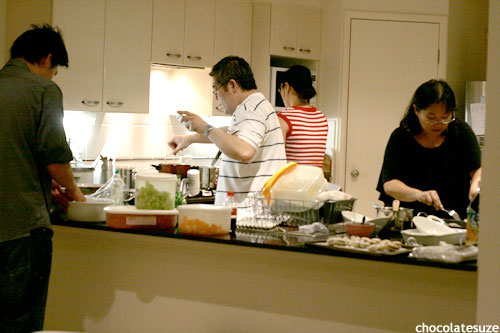
Image resolution: width=500 pixels, height=333 pixels. I want to click on door, so click(x=378, y=69).